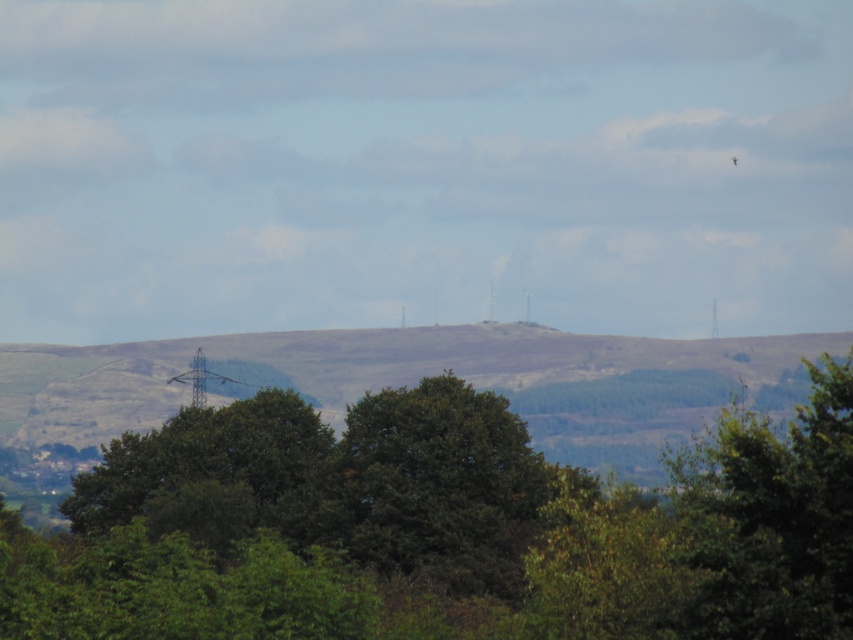
You are a hiker trying to navigate through the landscape. You need to choose between passing through the green leafy tree at center or the green grassy hillside at center. Which path is wider?

The green grassy hillside at center is wider than the green leafy tree at center, so you should choose the green grassy hillside at center for a wider path.

You are a hiker planning to navigate through the hills. You have two reference points marked as point (131, 608) and point (758, 378). Which point should you prioritize visiting first if you want to reach the one closer to your current position?

Point (131, 608) is in front of point (758, 378), so you should prioritize visiting point (131, 608) first since it is closer to your current position.

You are a hiker trying to decide whether to take a shortcut through the scene. The green leafy tree at center and the green grassy hillside at center are both in your path. Which one do you need to climb over?

The green grassy hillside at center is taller than the green leafy tree at center, so you need to climb over the green grassy hillside at center.